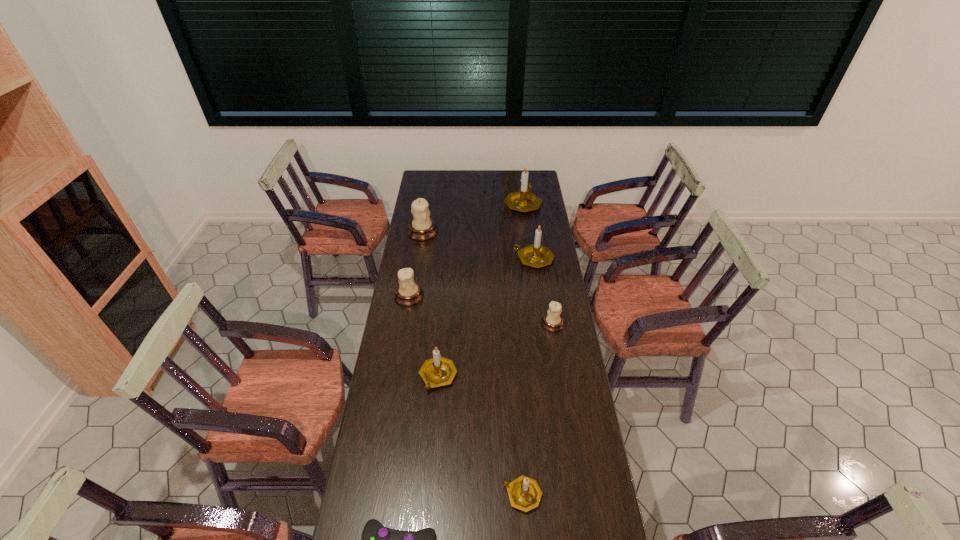
You are a GUI agent. You are given a task and a screenshot of the screen. Output one action in this format:
    pyautogui.click(x=<x>, y=<y>)
    Task: Click on the unoccupied area between the nearest candle holder and the fifth farthest candle holder
    This screenshot has width=960, height=540.
    Given the screenshot: What is the action you would take?
    pyautogui.click(x=538, y=409)

Image resolution: width=960 pixels, height=540 pixels. What are the coordinates of `vacant area between the third nearest candle holder and the smallest gold candle holder` in the screenshot? It's located at (538, 409).

Select which object appears as the third closest to the fifth farthest candle holder. Please provide its 2D coordinates. Your answer should be formatted as a tuple, i.e. [(x, y)], where the tuple contains the x and y coordinates of a point satisfying the conditions above.

[(408, 293)]

The image size is (960, 540). What are the coordinates of `object that is the closest one to the smallest white candle holder` in the screenshot? It's located at (535, 255).

Identify the location of the fifth closest candle holder to the farthest candle holder. (438, 371).

At what (x,y) coordinates should I click in order to perform the action: click on candle holder object that ranks as the sixth closest to the second smallest gold candle holder. Please return your answer as a coordinate pair (x, y). Image resolution: width=960 pixels, height=540 pixels. Looking at the image, I should click on (524, 200).

Identify which gold candle holder is the second closest to the seventh farthest object. Please provide its 2D coordinates. Your answer should be formatted as a tuple, i.e. [(x, y)], where the tuple contains the x and y coordinates of a point satisfying the conditions above.

[(535, 255)]

Identify the location of gold candle holder that is the second closest to the second nearest object. (535, 255).

Identify which white candle holder is located as the third nearest to the sixth nearest object. Please provide its 2D coordinates. Your answer should be formatted as a tuple, i.e. [(x, y)], where the tuple contains the x and y coordinates of a point satisfying the conditions above.

[(408, 293)]

You are a GUI agent. You are given a task and a screenshot of the screen. Output one action in this format:
    pyautogui.click(x=<x>, y=<y>)
    Task: Click on the white candle holder that can be found as the third closest to the fifth nearest candle holder
    The image size is (960, 540).
    Given the screenshot: What is the action you would take?
    pyautogui.click(x=408, y=293)